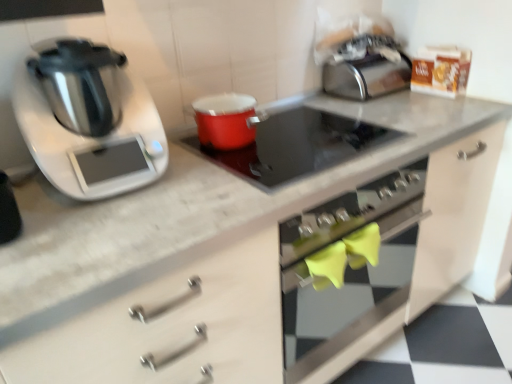
Question: From the image's perspective, is smooth glass cooktop at center located beneath satin silver toaster at upper right?

Choices:
 (A) no
 (B) yes

Answer: (B)

Question: Is smooth glass cooktop at center facing towards satin silver toaster at upper right?

Choices:
 (A) yes
 (B) no

Answer: (B)

Question: Is the position of smooth glass cooktop at center less distant than that of satin silver toaster at upper right?

Choices:
 (A) yes
 (B) no

Answer: (A)

Question: Can you confirm if smooth glass cooktop at center is wider than satin silver toaster at upper right?

Choices:
 (A) no
 (B) yes

Answer: (B)

Question: Is smooth glass cooktop at center outside of satin silver toaster at upper right?

Choices:
 (A) yes
 (B) no

Answer: (A)

Question: Does point (71, 160) appear closer or farther from the camera than point (288, 180)?

Choices:
 (A) farther
 (B) closer

Answer: (B)

Question: Is shiny metallic pressure cooker at left wider or thinner than smooth glass cooktop at center?

Choices:
 (A) thin
 (B) wide

Answer: (A)

Question: From the image's perspective, relative to smooth glass cooktop at center, is shiny metallic pressure cooker at left above or below?

Choices:
 (A) above
 (B) below

Answer: (A)

Question: Is shiny metallic pressure cooker at left to the left or to the right of smooth glass cooktop at center in the image?

Choices:
 (A) left
 (B) right

Answer: (A)

Question: In terms of size, does shiny metallic pressure cooker at left appear bigger or smaller than matte red pot at center?

Choices:
 (A) small
 (B) big

Answer: (B)

Question: Is shiny metallic pressure cooker at left inside or outside of matte red pot at center?

Choices:
 (A) outside
 (B) inside

Answer: (A)

Question: Is point (45, 92) positioned closer to the camera than point (245, 134)?

Choices:
 (A) farther
 (B) closer

Answer: (B)

Question: From a real-world perspective, is shiny metallic pressure cooker at left physically located above or below matte red pot at center?

Choices:
 (A) below
 (B) above

Answer: (B)

Question: Relative to smooth glass cooktop at center, is satin silver toaster at upper right in front or behind?

Choices:
 (A) front
 (B) behind

Answer: (B)

Question: Visually, is satin silver toaster at upper right positioned to the left or to the right of smooth glass cooktop at center?

Choices:
 (A) left
 (B) right

Answer: (B)